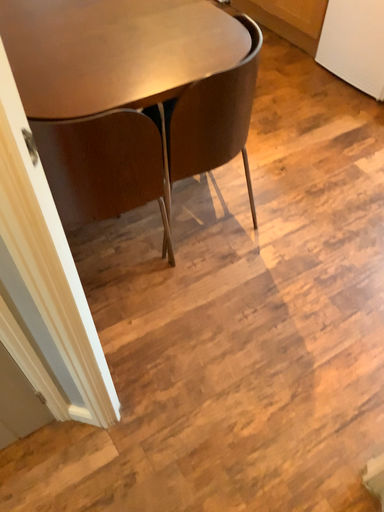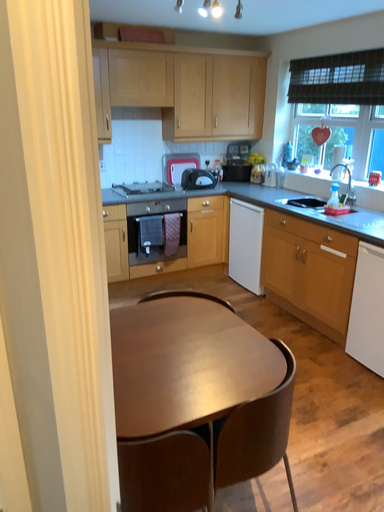
Question: How did the camera likely rotate when shooting the video?

Choices:
 (A) rotated upward
 (B) rotated downward

Answer: (A)